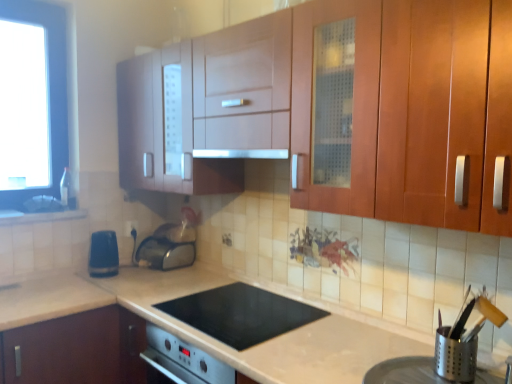
Question: From a real-world perspective, is satin silver toaster at lower center, arranged as the 1th appliance when viewed from the back, on top of satin silver exhaust hood at center?

Choices:
 (A) no
 (B) yes

Answer: (A)

Question: Is satin silver toaster at lower center, which is the third appliance in right-to-left order, to the left of satin silver exhaust hood at center from the viewer's perspective?

Choices:
 (A) yes
 (B) no

Answer: (A)

Question: Can you confirm if satin silver toaster at lower center, arranged as the 1th appliance when viewed from the back, is taller than satin silver exhaust hood at center?

Choices:
 (A) yes
 (B) no

Answer: (A)

Question: Could you tell me if satin silver toaster at lower center, the 2th appliance when ordered from left to right, is facing satin silver exhaust hood at center?

Choices:
 (A) no
 (B) yes

Answer: (A)

Question: Is satin silver exhaust hood at center completely or partially inside satin silver toaster at lower center, the 2th appliance when ordered from left to right?

Choices:
 (A) no
 (B) yes

Answer: (A)

Question: Is satin silver toaster at lower center, the 2th appliance when ordered from left to right, closer to camera compared to satin silver exhaust hood at center?

Choices:
 (A) no
 (B) yes

Answer: (A)

Question: Can you confirm if satin silver toaster at lower center, which is the third appliance in right-to-left order, is thinner than silver metallic utensil holder at lower right, which is the 4th appliance in back-to-front order?

Choices:
 (A) yes
 (B) no

Answer: (A)

Question: Can you confirm if satin silver toaster at lower center, positioned as the fourth appliance in front-to-back order, is taller than silver metallic utensil holder at lower right, which is the 4th appliance in back-to-front order?

Choices:
 (A) no
 (B) yes

Answer: (B)

Question: From a real-world perspective, is satin silver toaster at lower center, positioned as the fourth appliance in front-to-back order, on silver metallic utensil holder at lower right, which is counted as the second appliance, starting from the right?

Choices:
 (A) no
 (B) yes

Answer: (B)

Question: Is silver metallic utensil holder at lower right, the third appliance positioned from the left, completely or partially inside satin silver toaster at lower center, arranged as the 1th appliance when viewed from the back?

Choices:
 (A) no
 (B) yes

Answer: (A)

Question: Is satin silver toaster at lower center, arranged as the 1th appliance when viewed from the back, oriented away from silver metallic utensil holder at lower right, the first appliance positioned from the front?

Choices:
 (A) no
 (B) yes

Answer: (A)

Question: Is satin silver toaster at lower center, arranged as the 1th appliance when viewed from the back, far away from silver metallic utensil holder at lower right, which is counted as the second appliance, starting from the right?

Choices:
 (A) no
 (B) yes

Answer: (B)

Question: Does silver metallic utensil holder at lower right, the 2th appliance from the front, have a smaller size compared to blue plastic electric outlet at lower left?

Choices:
 (A) yes
 (B) no

Answer: (B)